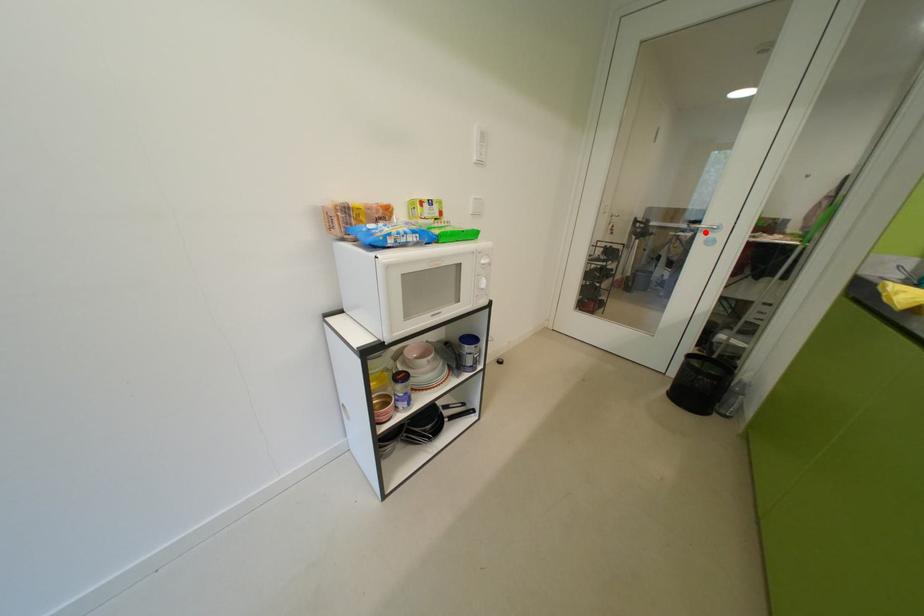
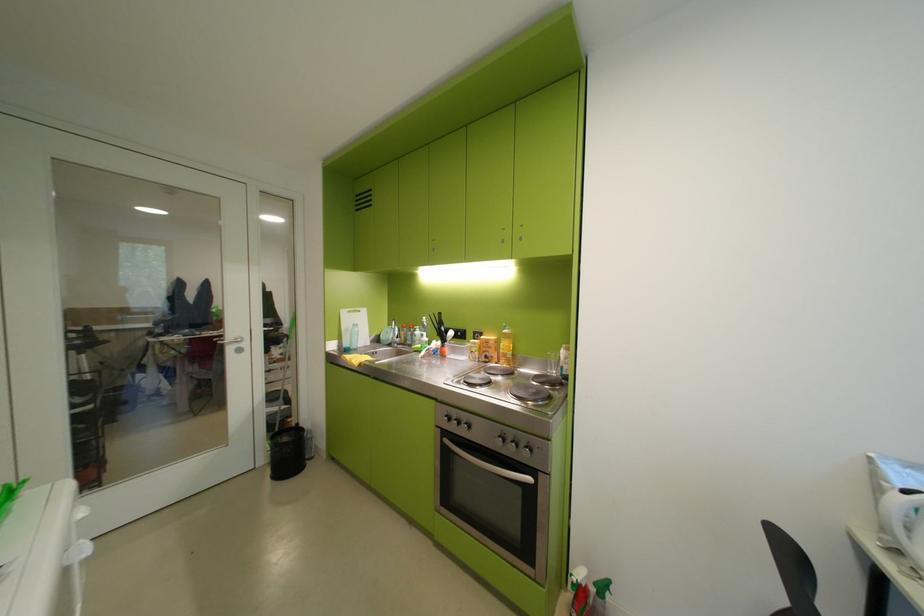
The point at the highlighted location is marked in the first image. Where is the corresponding point in the second image?

(233, 346)